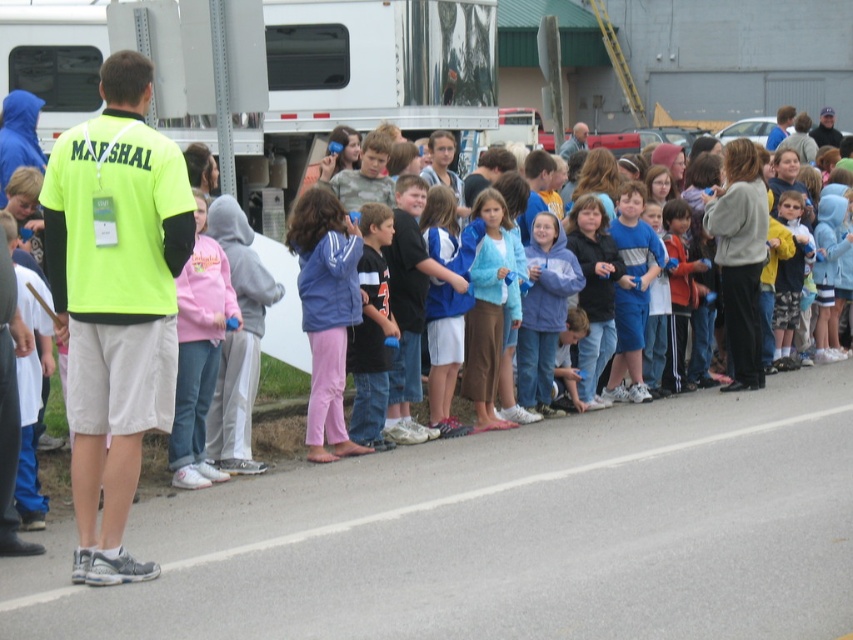
You are a photographer standing at the edge of the smooth asphalt road at lower center and the pink fleece jacket at center. Which object is closer to your right side?

The smooth asphalt road at lower center is positioned on the right side of pink fleece jacket at center, so the smooth asphalt road at lower center is closer to your right side.

You are standing at the edge of the road and want to take a photo of the neon yellow shirt at left and the smooth asphalt road at lower center. Which object will appear larger in the photo?

The smooth asphalt road at lower center will appear larger in the photo because it is closer to the viewer than the neon yellow shirt at left.